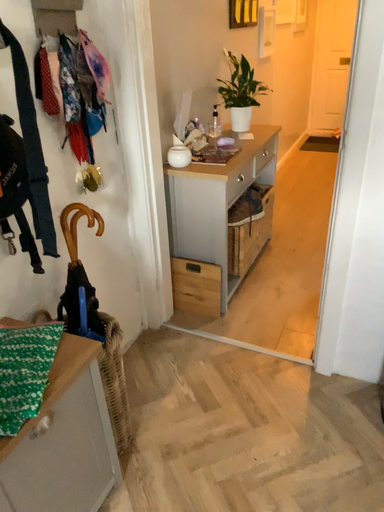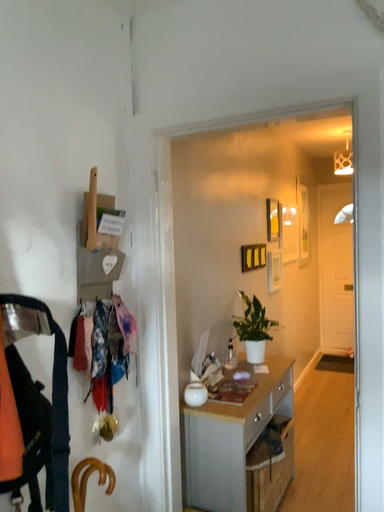
Question: Which way did the camera rotate in the video?

Choices:
 (A) rotated upward
 (B) rotated downward

Answer: (A)